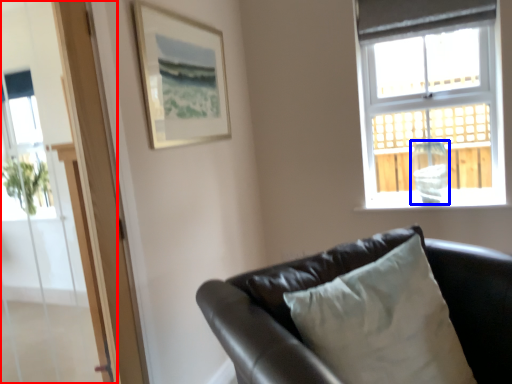
Question: Which object is closer to the camera taking this photo, screen door (highlighted by a red box) or glass vase (highlighted by a blue box)?

Choices:
 (A) screen door
 (B) glass vase

Answer: (A)